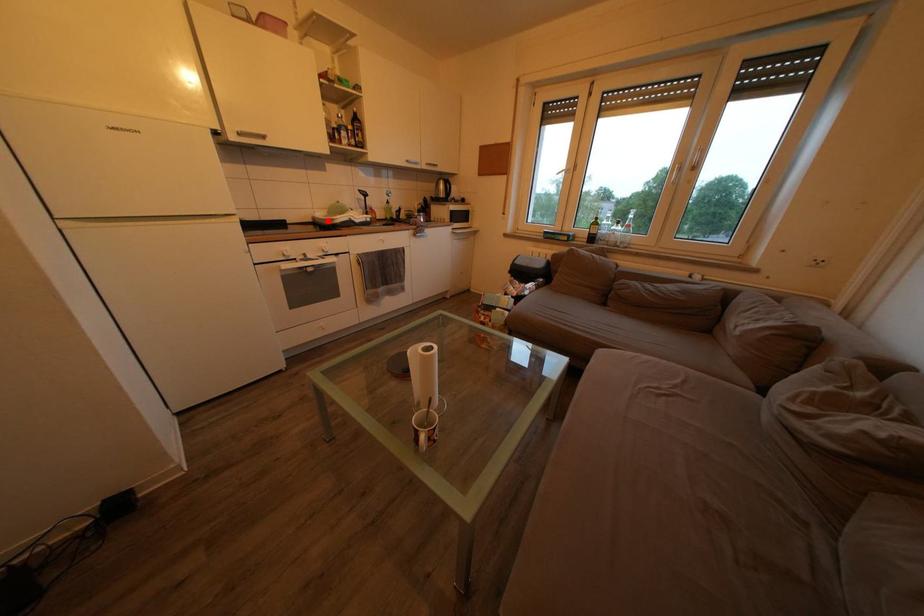
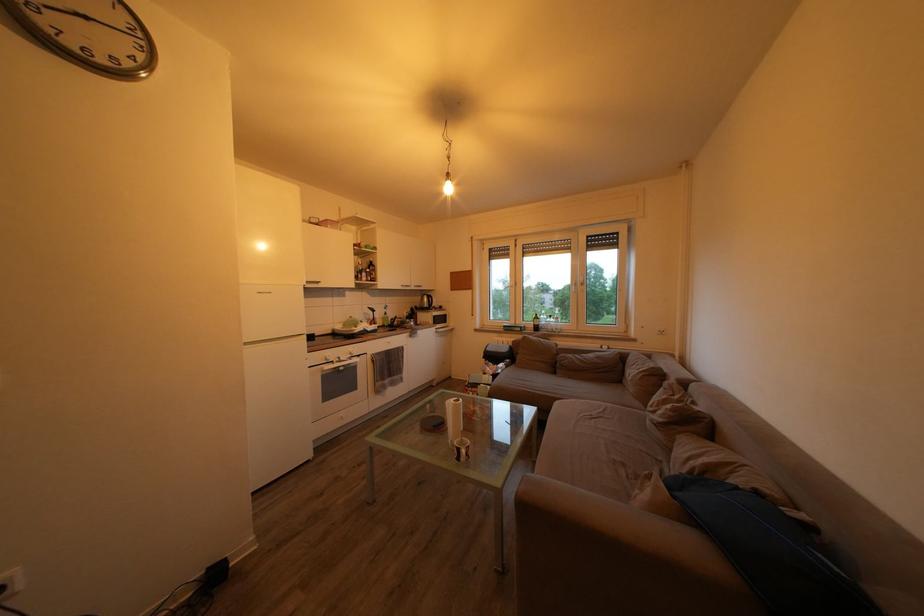
In the second image, find the point that corresponds to the highlighted location in the first image.

(346, 333)